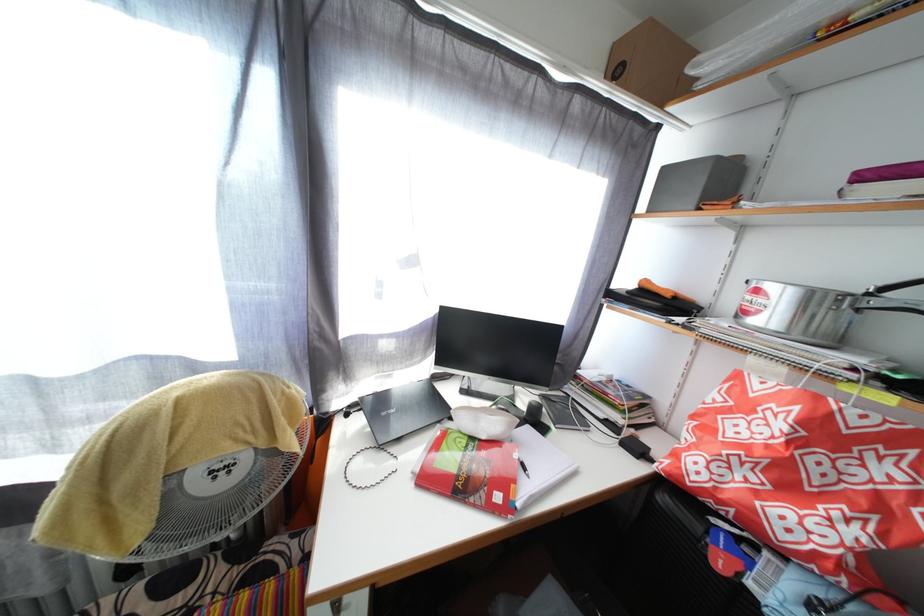
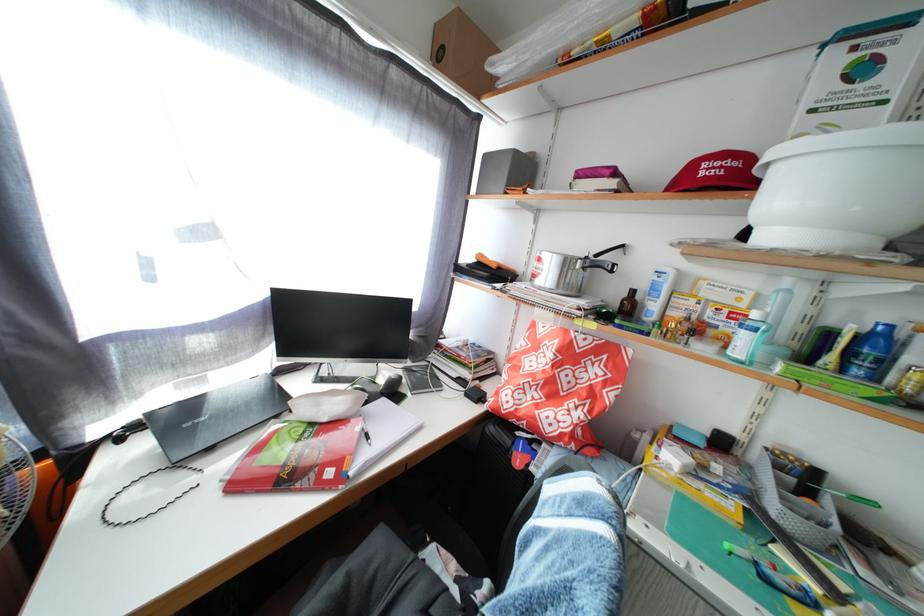
Where in the second image is the point corresponding to the point at 396,422 from the first image?

(204, 432)